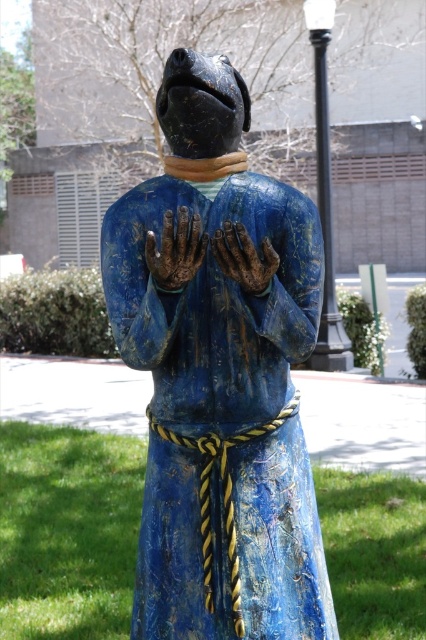
Is point (163, 268) closer to camera compared to point (256, 256)?

No, (163, 268) is behind (256, 256).

Who is more forward, (169, 221) or (252, 250)?

Positioned in front is point (169, 221).

Describe the element at coordinates (175, 250) in the screenshot. Image resolution: width=426 pixels, height=640 pixels. I see `brown textured hand at center` at that location.

Find the location of `brown textured hand at center`. brown textured hand at center is located at coordinates (175, 250).

Which of these two, blue painted wood statue at center or brown textured hand at center, stands shorter?

brown textured hand at center

Between blue painted wood statue at center and brown textured hand at center, which one appears on the right side from the viewer's perspective?

blue painted wood statue at center is more to the right.

This screenshot has width=426, height=640. What do you see at coordinates (221, 381) in the screenshot? I see `blue painted wood statue at center` at bounding box center [221, 381].

At what (x,y) coordinates should I click in order to perform the action: click on blue painted wood statue at center. Please return your answer as a coordinate pair (x, y). Looking at the image, I should click on (221, 381).

Between blue painted wood statue at center and brown matte hand at center, which one is positioned higher?

brown matte hand at center is higher up.

Is point (282, 593) less distant than point (232, 278)?

No, it is behind (232, 278).

Where is `blue painted wood statue at center`? This screenshot has height=640, width=426. blue painted wood statue at center is located at coordinates (221, 381).